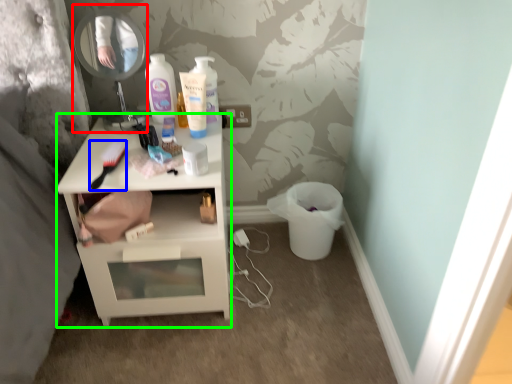
Question: Considering the real-world distances, which object is farthest from mirror (highlighted by a red box)? brush (highlighted by a blue box) or nightstand (highlighted by a green box)?

Choices:
 (A) brush
 (B) nightstand

Answer: (B)